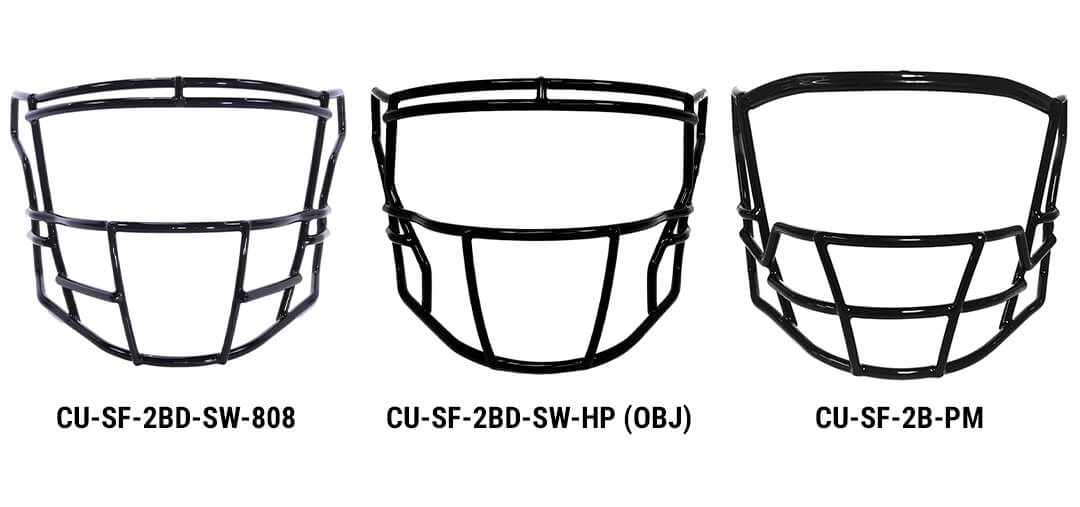
Image resolution: width=1080 pixels, height=507 pixels. Identify the location of background color. (906, 160), (552, 164), (190, 164).